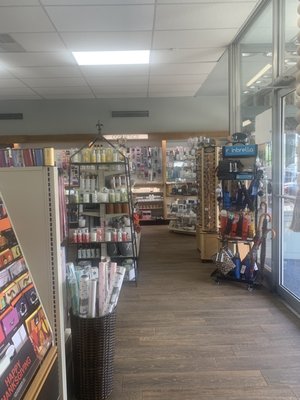
At what (x,y) coordinates should I click in order to perform the action: click on ceiling tile. Please return your answer as a coordinate pair (x, y). This screenshot has height=400, width=300. Looking at the image, I should click on (45, 79).